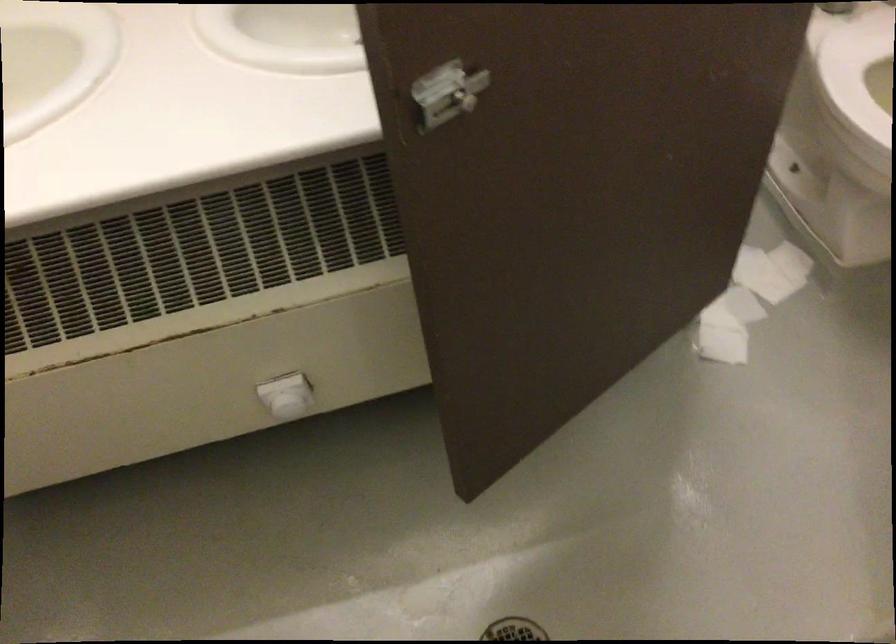
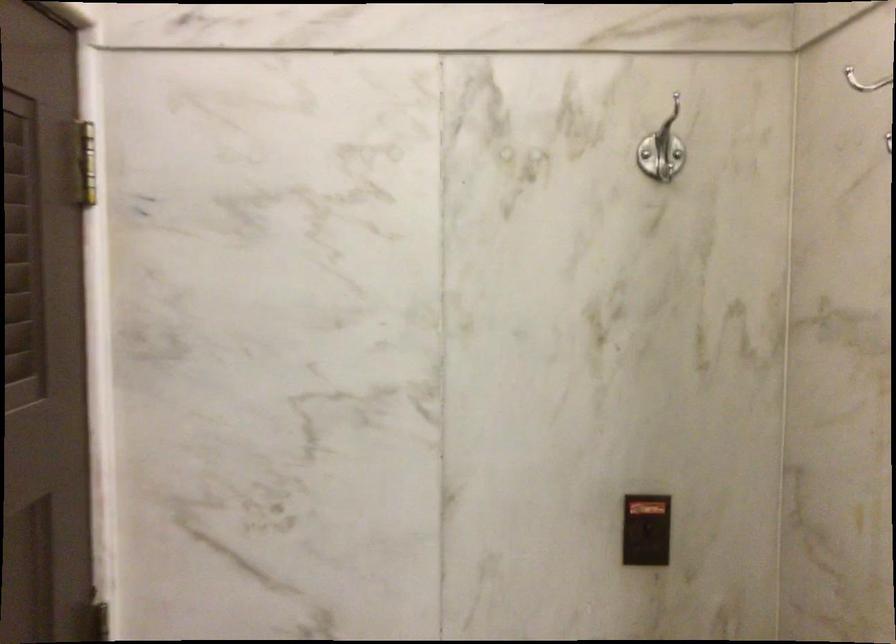
First-person continuous shooting, in which direction is the camera rotating?

The camera's rotation is toward left-down.